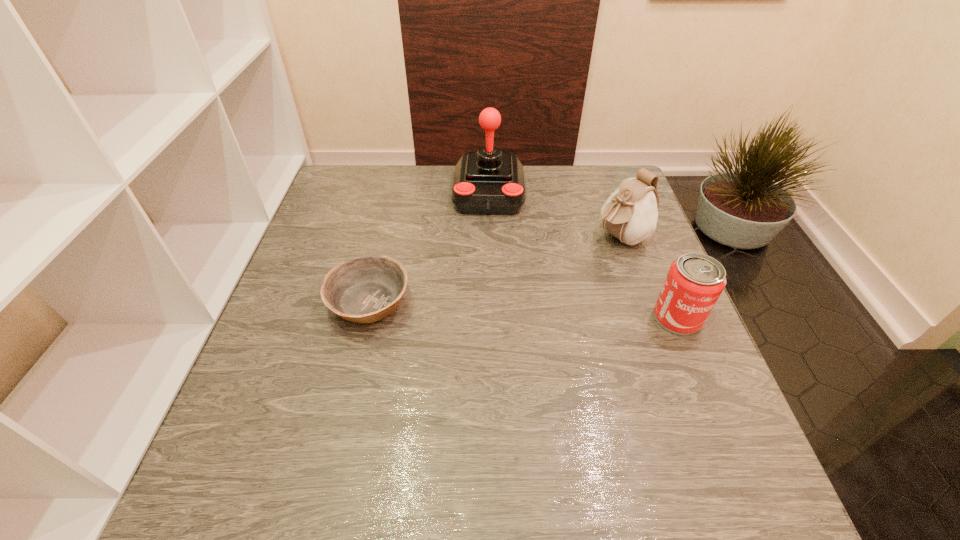
Locate an element on the screen. This screenshot has width=960, height=540. free space on the desktop that is between the bowl and the third tallest object and is positioned on the front-facing side of the pouch is located at coordinates (500, 309).

Where is `vacant space on the desktop that is between the leftmost object and the third tallest object and is positioned on the base of the tallest object`? vacant space on the desktop that is between the leftmost object and the third tallest object and is positioned on the base of the tallest object is located at coordinates (484, 309).